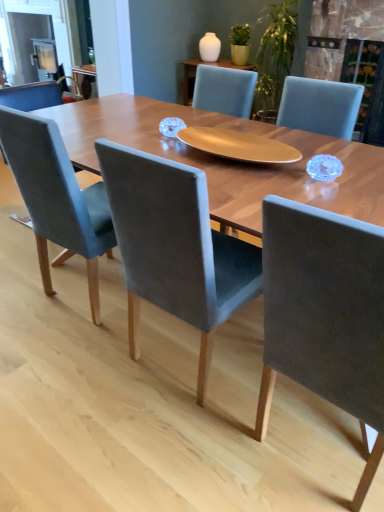
The image size is (384, 512). Find the location of `vacant space underneath velvet grey chair at left, acting as the 3th chair starting from the right (from a real-world perspective)`. vacant space underneath velvet grey chair at left, acting as the 3th chair starting from the right (from a real-world perspective) is located at coordinates (99, 294).